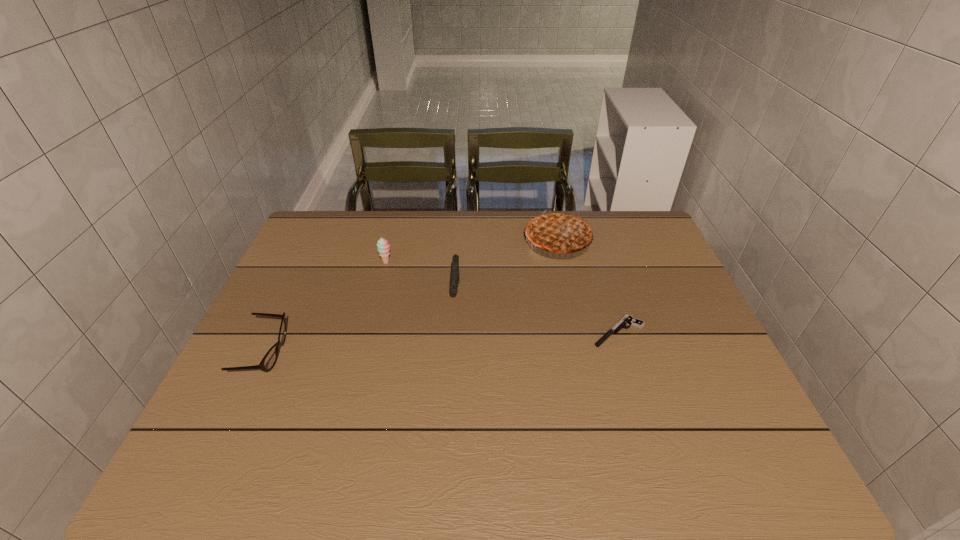
Where is `vacant space situated 0.200m at the barrel of the third object from right to left`? vacant space situated 0.200m at the barrel of the third object from right to left is located at coordinates (451, 369).

The image size is (960, 540). What are the coordinates of `free spot located 0.240m on the front-facing side of the fourth tallest object` in the screenshot? It's located at pyautogui.click(x=382, y=353).

Where is `vacant space located on the front-facing side of the nearer pistol`? Image resolution: width=960 pixels, height=540 pixels. vacant space located on the front-facing side of the nearer pistol is located at coordinates (525, 332).

This screenshot has width=960, height=540. Find the location of `blank space located on the front-facing side of the nearer pistol`. blank space located on the front-facing side of the nearer pistol is located at coordinates (567, 332).

What are the coordinates of `free space located 0.150m on the front-facing side of the nearer pistol` in the screenshot? It's located at (533, 332).

At what (x,y) coordinates should I click in order to perform the action: click on object situated at the far edge. Please return your answer as a coordinate pair (x, y). The image size is (960, 540). Looking at the image, I should click on (558, 232).

The height and width of the screenshot is (540, 960). Identify the location of object positioned at the left edge. (269, 360).

Identify the location of object located at the right edge. Image resolution: width=960 pixels, height=540 pixels. (627, 319).

I want to click on vacant point at the far edge, so click(x=375, y=233).

This screenshot has width=960, height=540. I want to click on vacant space at the near edge, so click(x=388, y=463).